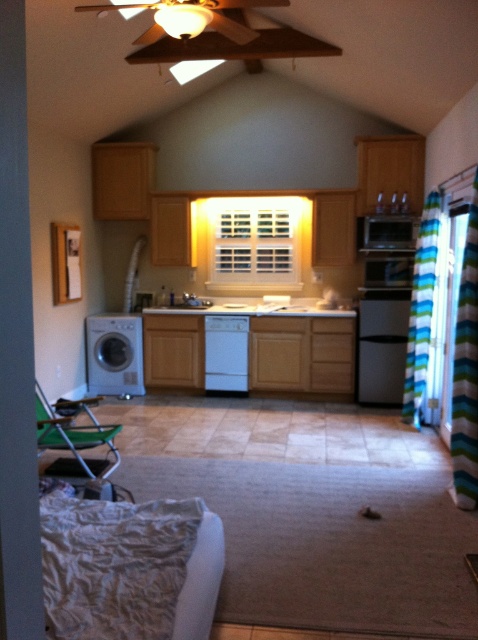
You are standing in the kitchen and want to place a new appliance next to the existing washer at point (115, 355). Can you confirm the exact location of the white matte washer at left to ensure proper placement?

The white matte washer at left is located at point (115, 355), so place the new appliance next to that coordinate for proper placement.

You are standing in the kitchen and want to reach a point marked at coordinates [118,364]. Considering your height is 1.7 meters, can you comfortably reach that point without any assistance?

The point at [118,364] is 6.22 meters away from your current position. Since the distance is quite large, you would need to move closer or use a tool to reach it comfortably.

You are trying to decide whether to place a tall plant next to the white matte washer at left or the satin silver microwave at upper center. Based on their heights, which appliance would be a better fit for the plant?

The white matte washer at left is much taller than the satin silver microwave at upper center, so placing the tall plant next to the white matte washer at left would be a better fit as it provides a proportional height comparison.